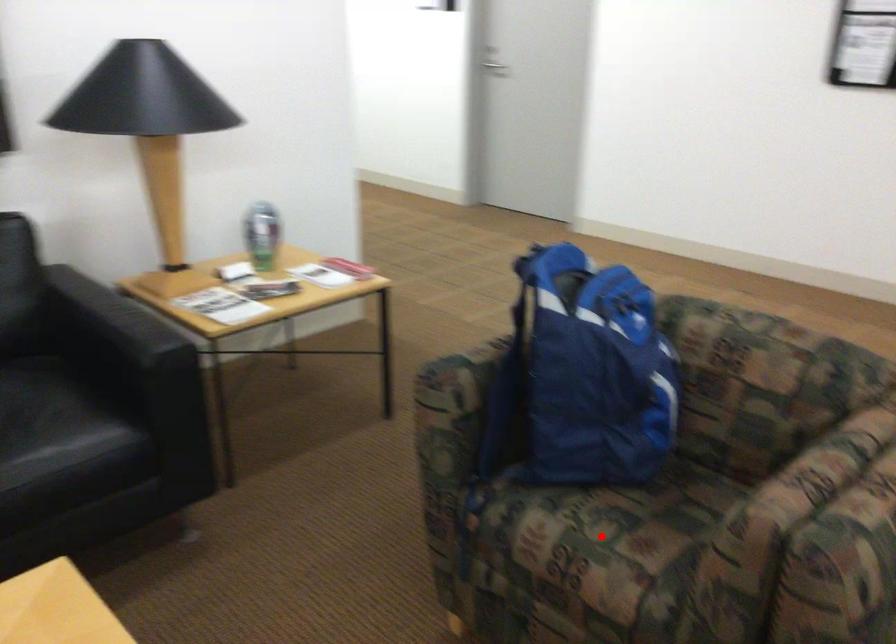
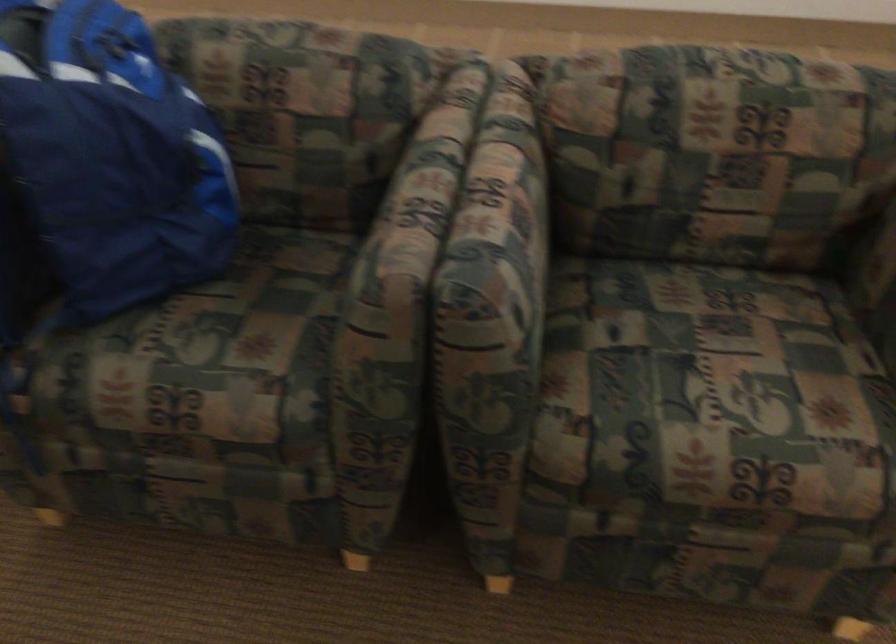
Question: A red point is marked in image1. In image2, is the corresponding 3D point closer to the camera or farther? Reply with the corresponding letter.

Choices:
 (A) The corresponding 3D point is closer.
 (B) The corresponding 3D point is farther.

Answer: (A)